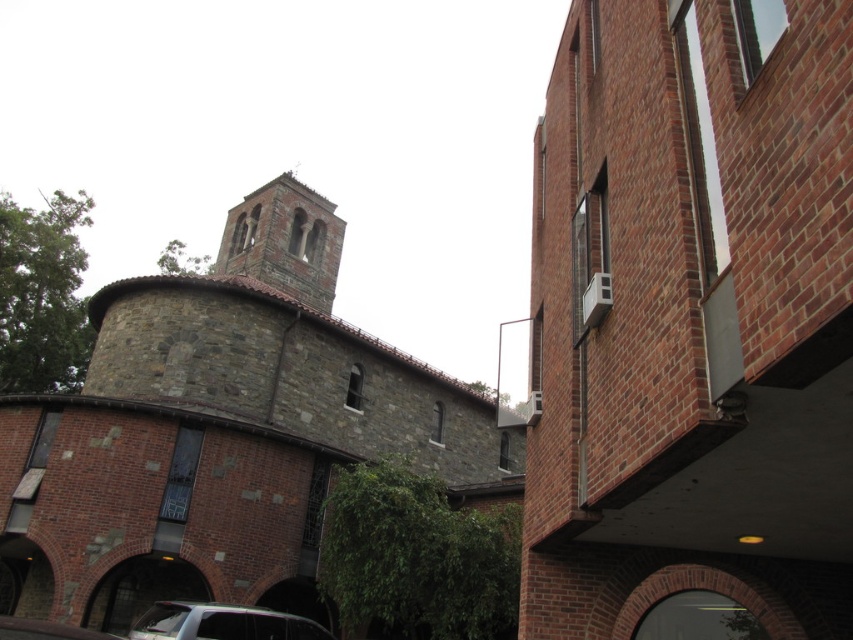
Question: Does brick building at right lie in front of metallic silver car at lower left?

Choices:
 (A) no
 (B) yes

Answer: (B)

Question: Is stone church at center to the left of metallic silver car at lower left from the viewer's perspective?

Choices:
 (A) no
 (B) yes

Answer: (A)

Question: Does stone church at center appear under metallic silver car at lower left?

Choices:
 (A) no
 (B) yes

Answer: (A)

Question: Which point is closer to the camera taking this photo?

Choices:
 (A) (809, 500)
 (B) (219, 630)
 (C) (117, 308)

Answer: (A)

Question: Based on their relative distances, which object is nearer to the metallic silver car at lower left?

Choices:
 (A) brick building at right
 (B) stone church at center

Answer: (A)

Question: Which of these objects is positioned closest to the stone church at center?

Choices:
 (A) metallic silver car at lower left
 (B) brick building at right

Answer: (A)